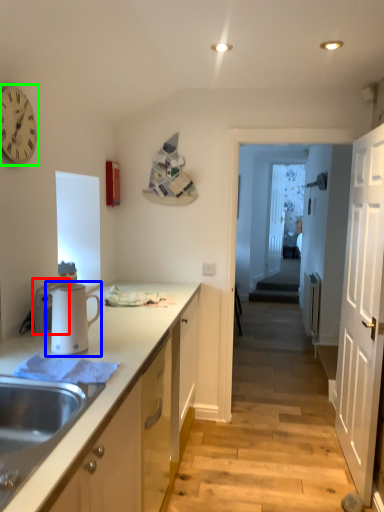
Question: Estimate the real-world distances between objects in this image. Which object is farther from appliance (highlighted by a red box), appliance (highlighted by a blue box) or clock (highlighted by a green box)?

Choices:
 (A) appliance
 (B) clock

Answer: (B)